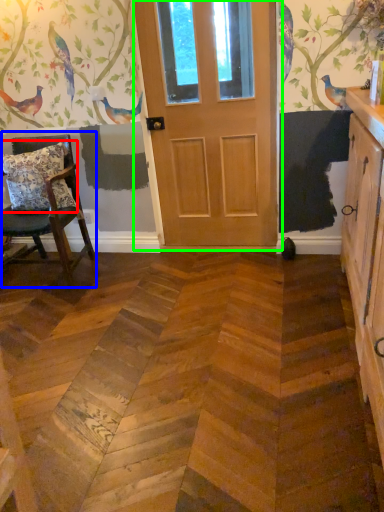
Question: Which object is positioned closest to pillow (highlighted by a red box)? Select from chair (highlighted by a blue box) and door (highlighted by a green box).

Choices:
 (A) chair
 (B) door

Answer: (A)